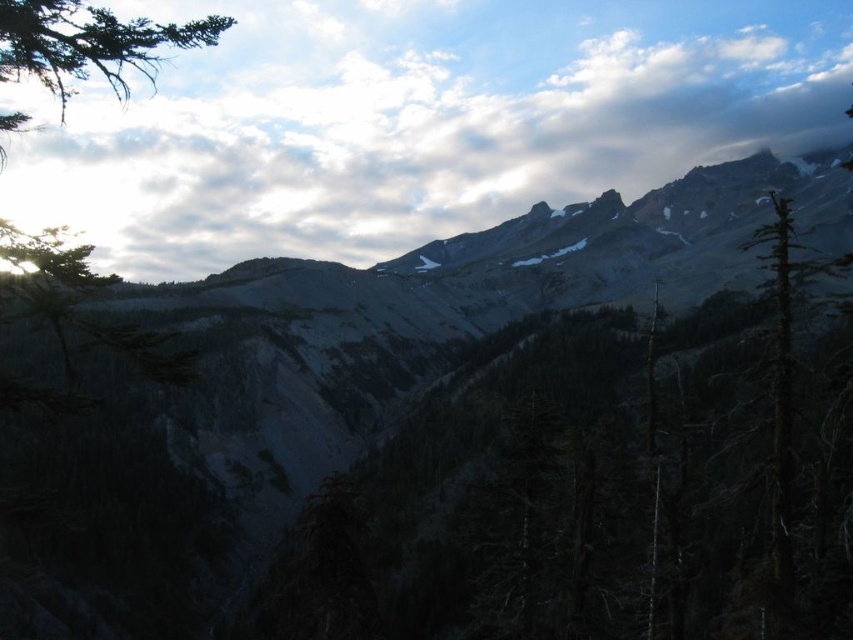
Which of these two, green textured pine branch at upper left or dark green textured tree at right, stands shorter?

Standing shorter between the two is dark green textured tree at right.

Is the position of green textured pine branch at upper left less distant than that of dark green textured tree at right?

That is True.

Which is in front, point (148, 28) or point (772, 468)?

Point (772, 468) is more forward.

Find the location of a particular element. The image size is (853, 640). green textured pine branch at upper left is located at coordinates pos(90,44).

Is white fluffy cloud at upper center shorter than dark green textured tree at right?

In fact, white fluffy cloud at upper center may be taller than dark green textured tree at right.

Can you confirm if white fluffy cloud at upper center is positioned above dark green textured tree at right?

Yes.

Identify the location of white fluffy cloud at upper center. (415, 122).

You are a GUI agent. You are given a task and a screenshot of the screen. Output one action in this format:
    pyautogui.click(x=<x>, y=<y>)
    Task: Click on the white fluffy cloud at upper center
    Image resolution: width=853 pixels, height=640 pixels.
    Given the screenshot: What is the action you would take?
    pyautogui.click(x=415, y=122)

Does white fluffy cloud at upper center have a lesser height compared to green textured pine branch at upper left?

Yes, white fluffy cloud at upper center is shorter than green textured pine branch at upper left.

Can you confirm if white fluffy cloud at upper center is positioned to the left of green textured pine branch at upper left?

No, white fluffy cloud at upper center is not to the left of green textured pine branch at upper left.

The width and height of the screenshot is (853, 640). Describe the element at coordinates (415, 122) in the screenshot. I see `white fluffy cloud at upper center` at that location.

Find the location of a particular element. Image resolution: width=853 pixels, height=640 pixels. white fluffy cloud at upper center is located at coordinates (415, 122).